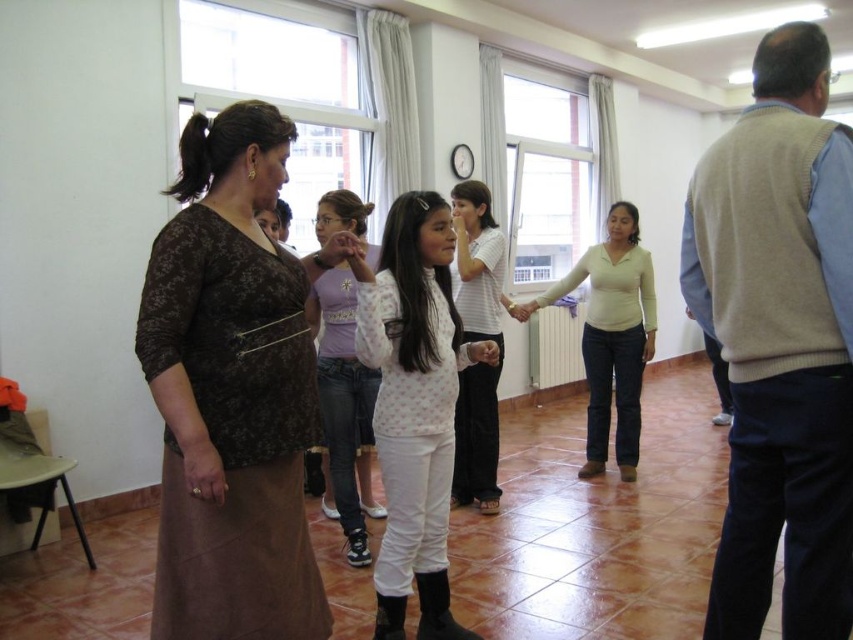
Can you confirm if light beige sweater at right is positioned to the left of brown textured skirt at left?

Incorrect, light beige sweater at right is not on the left side of brown textured skirt at left.

Does point (772, 436) come in front of point (241, 221)?

No, it is behind (241, 221).

Where is `light beige sweater at right`? light beige sweater at right is located at coordinates tap(780, 340).

Is brown textured skirt at left smaller than white matte sweater at center?

Yes, brown textured skirt at left is smaller than white matte sweater at center.

Does brown textured skirt at left come behind white matte sweater at center?

That is False.

Between point (305, 524) and point (653, 316), which one is positioned behind?

Point (653, 316)

Locate an element on the screen. brown textured skirt at left is located at coordinates (231, 392).

Does point (418, 323) come behind point (332, 410)?

No, (418, 323) is in front of (332, 410).

Where is `white matte pants at center`? The width and height of the screenshot is (853, 640). white matte pants at center is located at coordinates (415, 404).